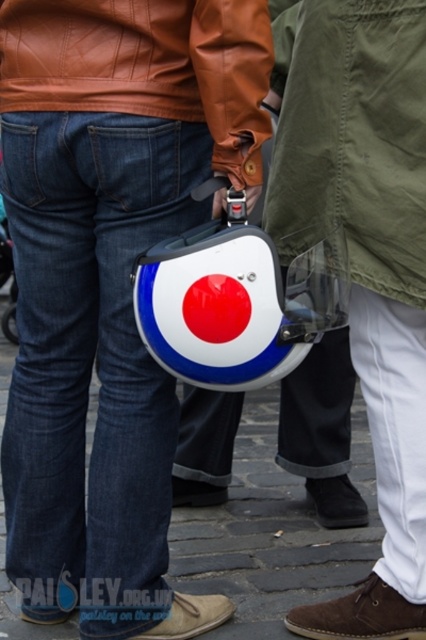
Who is positioned more to the left, olive green canvas jacket at center or white glossy helmet at center?

white glossy helmet at center is more to the left.

Which is more to the right, olive green canvas jacket at center or white glossy helmet at center?

olive green canvas jacket at center is more to the right.

Is point (399, 56) in front of point (261, 620)?

Yes, it is.

Find the location of `olive green canvas jacket at center`. olive green canvas jacket at center is located at coordinates (354, 134).

Based on the photo, does olive green canvas jacket at center appear on the right side of shiny plastic helmet at center?

Yes, olive green canvas jacket at center is to the right of shiny plastic helmet at center.

Can you confirm if olive green canvas jacket at center is thinner than shiny plastic helmet at center?

Yes, olive green canvas jacket at center is thinner than shiny plastic helmet at center.

Find the location of a particular element. The width and height of the screenshot is (426, 640). olive green canvas jacket at center is located at coordinates (354, 134).

The image size is (426, 640). Identify the location of olive green canvas jacket at center. (354, 134).

Does olive green canvas jacket at center have a larger size compared to brown leather jacket at upper center?

Yes, olive green canvas jacket at center is bigger than brown leather jacket at upper center.

Does olive green canvas jacket at center lie in front of brown leather jacket at upper center?

No, it is behind brown leather jacket at upper center.

Between point (408, 230) and point (8, 51), which one is positioned in front?

Point (8, 51) is more forward.

The height and width of the screenshot is (640, 426). Find the location of `olive green canvas jacket at center`. olive green canvas jacket at center is located at coordinates (354, 134).